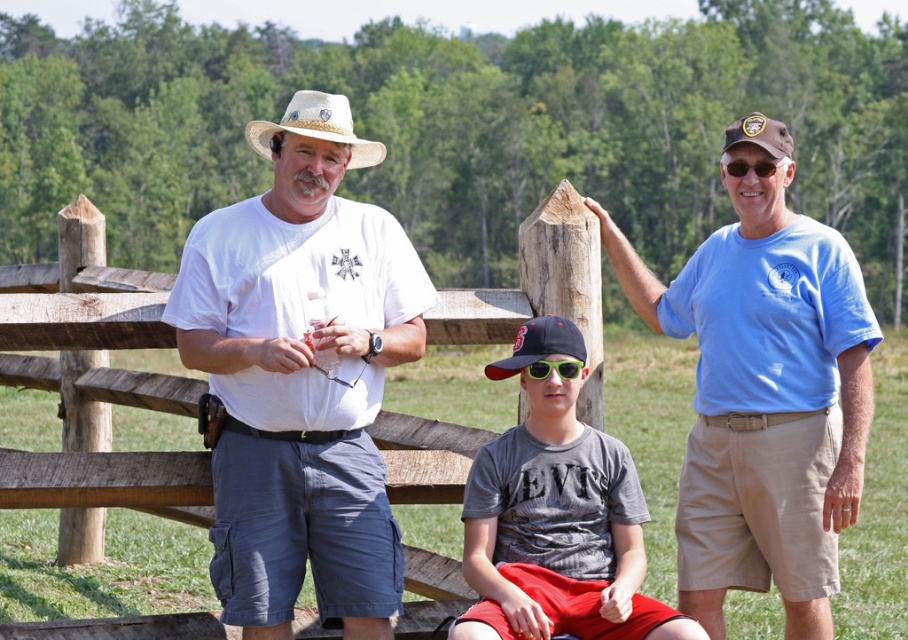
Question: Is brown straw hat at upper right further to the viewer compared to green matte sunglasses at center?

Choices:
 (A) no
 (B) yes

Answer: (B)

Question: Considering the real-world distances, which object is farthest from the blue cotton shirt at right?

Choices:
 (A) white cotton shirt at center
 (B) gray cotton t-shirt at center
 (C) black plastic sunglasses at right
 (D) natural straw cowboy hat at center

Answer: (D)

Question: Estimate the real-world distances between objects in this image. Which object is farther from the black plastic sunglasses at right?

Choices:
 (A) green matte sunglasses at center
 (B) natural straw cowboy hat at center
 (C) white cotton shirt at center
 (D) straw hat at center

Answer: (B)

Question: Does straw hat at center appear on the right side of green matte sunglasses at center?

Choices:
 (A) yes
 (B) no

Answer: (B)

Question: Is brown straw hat at upper right thinner than black plastic sunglasses at right?

Choices:
 (A) no
 (B) yes

Answer: (A)

Question: Which point is closer to the camera?

Choices:
 (A) (307, 179)
 (B) (739, 170)
 (C) (290, 116)

Answer: (A)